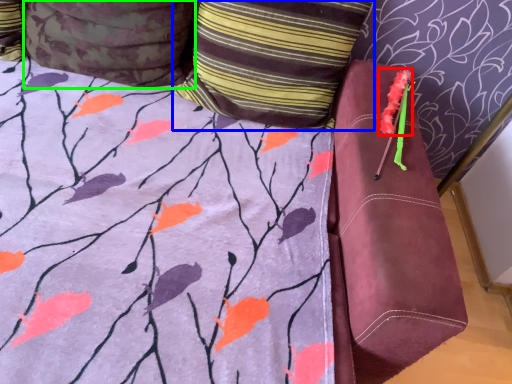
Question: Considering the real-world distances, which object is closest to flower (highlighted by a red box)? pillow (highlighted by a blue box) or pillow (highlighted by a green box).

Choices:
 (A) pillow
 (B) pillow

Answer: (A)